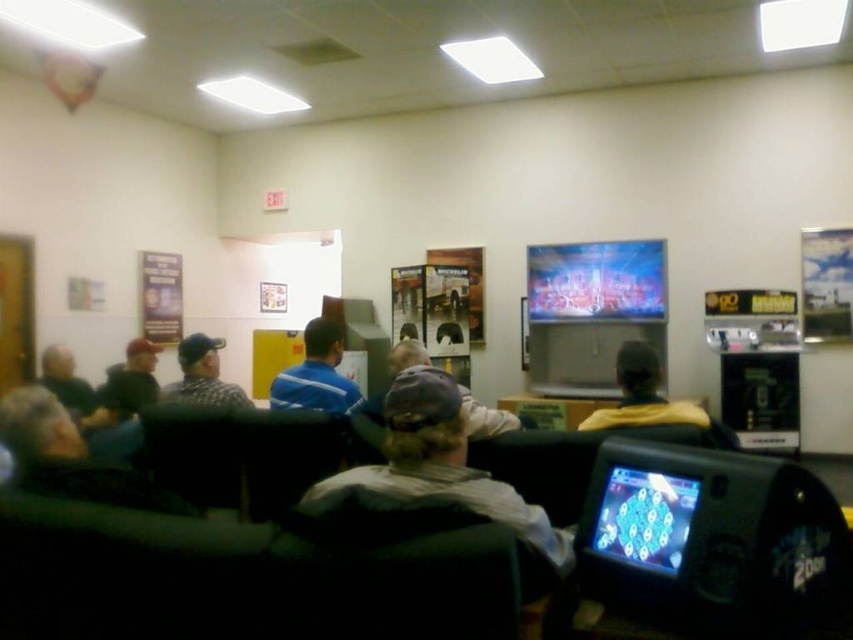
Between yellow fleece jacket at center and dark gray baseball cap at left, which one is positioned lower?

dark gray baseball cap at left is below.

Where is `yellow fleece jacket at center`? The width and height of the screenshot is (853, 640). yellow fleece jacket at center is located at coordinates (642, 394).

What do you see at coordinates (642, 394) in the screenshot?
I see `yellow fleece jacket at center` at bounding box center [642, 394].

You are a GUI agent. You are given a task and a screenshot of the screen. Output one action in this format:
    pyautogui.click(x=<x>, y=<y>)
    Task: Click on the yellow fleece jacket at center
    The image size is (853, 640).
    Given the screenshot: What is the action you would take?
    pyautogui.click(x=642, y=394)

Can you confirm if gray fabric jacket at center is positioned above dark gray hoodie at left?

Yes, gray fabric jacket at center is above dark gray hoodie at left.

Does point (407, 348) come closer to viewer compared to point (62, 360)?

Yes, it is in front of point (62, 360).

This screenshot has height=640, width=853. Find the location of `gray fabric jacket at center`. gray fabric jacket at center is located at coordinates (485, 417).

Can you confirm if yellow fleece jacket at center is positioned above gray fabric jacket at center?

Correct, yellow fleece jacket at center is located above gray fabric jacket at center.

Is yellow fleece jacket at center positioned behind gray fabric jacket at center?

Yes, yellow fleece jacket at center is behind gray fabric jacket at center.

Is point (651, 401) positioned before point (379, 419)?

Yes, it is in front of point (379, 419).

Locate an element on the screen. Image resolution: width=853 pixels, height=640 pixels. yellow fleece jacket at center is located at coordinates (642, 394).